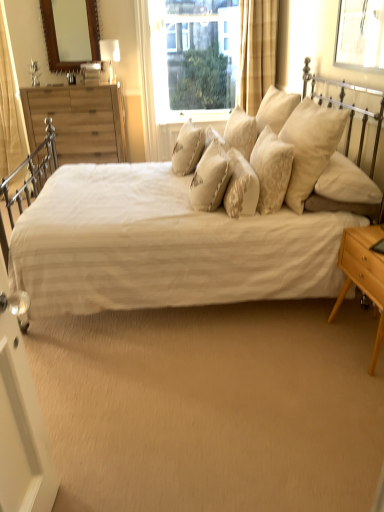
Question: Does beige textured pillow at center, the second pillow viewed from the left, turn towards textured cream pillow at center, the sixth pillow in the right-to-left sequence?

Choices:
 (A) yes
 (B) no

Answer: (B)

Question: From a real-world perspective, is beige textured pillow at center, the fifth pillow from the right, positioned over textured cream pillow at center, the sixth pillow in the right-to-left sequence, based on gravity?

Choices:
 (A) no
 (B) yes

Answer: (A)

Question: Can you confirm if beige textured pillow at center, the second pillow viewed from the left, is shorter than textured cream pillow at center, arranged as the 1th pillow when viewed from the left?

Choices:
 (A) no
 (B) yes

Answer: (A)

Question: Is beige textured pillow at center, the fifth pillow from the right, taller than textured cream pillow at center, arranged as the 1th pillow when viewed from the left?

Choices:
 (A) yes
 (B) no

Answer: (A)

Question: Is beige textured pillow at center, the fifth pillow from the right, next to textured cream pillow at center, arranged as the 1th pillow when viewed from the left?

Choices:
 (A) yes
 (B) no

Answer: (B)

Question: Is beige textured pillow at center, the second pillow viewed from the left, at the right side of textured cream pillow at center, the sixth pillow in the right-to-left sequence?

Choices:
 (A) no
 (B) yes

Answer: (B)

Question: Does creamy fabric pillow at center, which is the 5th pillow from left to right, have a lesser height compared to beige textured pillow at center, which ranks as the third pillow in left-to-right order?

Choices:
 (A) no
 (B) yes

Answer: (A)

Question: From a real-world perspective, is creamy fabric pillow at center, which is the 5th pillow from left to right, below beige textured pillow at center, acting as the 4th pillow starting from the right?

Choices:
 (A) yes
 (B) no

Answer: (B)

Question: Considering the relative sizes of creamy fabric pillow at center, which ranks as the second pillow in right-to-left order, and beige textured pillow at center, which ranks as the third pillow in left-to-right order, in the image provided, is creamy fabric pillow at center, which ranks as the second pillow in right-to-left order, taller than beige textured pillow at center, which ranks as the third pillow in left-to-right order,?

Choices:
 (A) yes
 (B) no

Answer: (A)

Question: From a real-world perspective, is creamy fabric pillow at center, which is the 5th pillow from left to right, physically above beige textured pillow at center, acting as the 4th pillow starting from the right?

Choices:
 (A) yes
 (B) no

Answer: (A)

Question: Is creamy fabric pillow at center, which is the 5th pillow from left to right, touching beige textured pillow at center, acting as the 4th pillow starting from the right?

Choices:
 (A) no
 (B) yes

Answer: (A)

Question: Does creamy fabric pillow at center, which is the 5th pillow from left to right, have a smaller size compared to beige textured pillow at center, acting as the 4th pillow starting from the right?

Choices:
 (A) yes
 (B) no

Answer: (A)

Question: From a real-world perspective, is white glossy screen door at lower left on top of creamy fabric pillow at center, which is the 5th pillow from left to right?

Choices:
 (A) yes
 (B) no

Answer: (B)